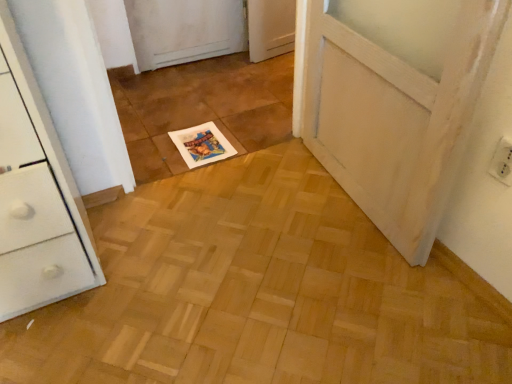
Question: Is point (222, 145) positioned closer to the camera than point (505, 180)?

Choices:
 (A) closer
 (B) farther

Answer: (B)

Question: From the image's perspective, is white paper magazine at center above or below white plastic electric outlet at upper right?

Choices:
 (A) above
 (B) below

Answer: (A)

Question: Looking at the image, does white paper magazine at center seem bigger or smaller compared to white plastic electric outlet at upper right?

Choices:
 (A) small
 (B) big

Answer: (B)

Question: From a real-world perspective, relative to white paper magazine at center, is white plastic electric outlet at upper right vertically above or below?

Choices:
 (A) above
 (B) below

Answer: (A)

Question: Is white plastic electric outlet at upper right inside or outside of white paper magazine at center?

Choices:
 (A) inside
 (B) outside

Answer: (B)

Question: Considering the positions of point (501, 158) and point (211, 142), is point (501, 158) closer or farther from the camera than point (211, 142)?

Choices:
 (A) farther
 (B) closer

Answer: (B)

Question: From the image's perspective, relative to white paper magazine at center, is white plastic electric outlet at upper right above or below?

Choices:
 (A) above
 (B) below

Answer: (B)